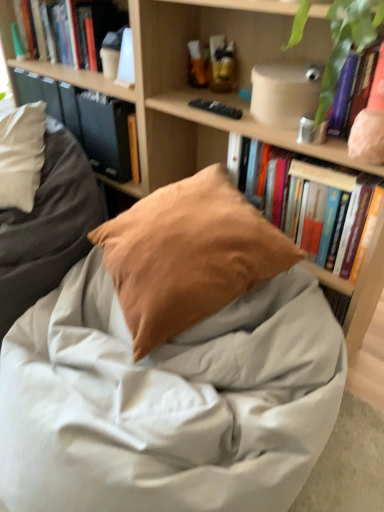
Image resolution: width=384 pixels, height=512 pixels. Describe the element at coordinates (80, 30) in the screenshot. I see `hardcover book at upper left, placed as the first book when sorted from back to front` at that location.

Measure the distance between hardcover book at upper left, placed as the 1th book when sorted from left to right, and camera.

hardcover book at upper left, placed as the 1th book when sorted from left to right, and camera are 1.42 meters apart from each other.

Identify the location of green leafy plant at upper right. (347, 42).

Identify the location of hardcover book at upper left. pos(106,133).

Locate an element on the screen. This screenshot has height=512, width=384. hardcover book at upper right, placed as the second book when sorted from back to front is located at coordinates (323, 176).

What do you see at coordinates (323, 176) in the screenshot? The image size is (384, 512). I see `hardcover book at upper right, which is the first book from bottom to top` at bounding box center [323, 176].

Where is `hardcover book at upper left, the second book when ordered from bottom to top`? hardcover book at upper left, the second book when ordered from bottom to top is located at coordinates (80, 30).

Is hardcover book at upper right, marked as the first book in a right-to-left arrangement, aimed at green leafy plant at upper right?

No.

From the image's perspective, would you say hardcover book at upper right, the 2th book viewed from the left, is positioned over green leafy plant at upper right?

No, from the image's perspective, hardcover book at upper right, the 2th book viewed from the left, is not on top of green leafy plant at upper right.

Between hardcover book at upper right, the 2th book viewed from the left, and green leafy plant at upper right, which one has less height?

green leafy plant at upper right.

Based on the photo, in terms of height, does wooden bookshelf at center look taller or shorter compared to light gray cotton blanket at center?

Clearly, wooden bookshelf at center is taller compared to light gray cotton blanket at center.

Would you say wooden bookshelf at center is to the left or to the right of light gray cotton blanket at center in the picture?

From the image, it's evident that wooden bookshelf at center is to the right of light gray cotton blanket at center.

Is point (142, 127) closer or farther from the camera than point (152, 398)?

Clearly, point (142, 127) is more distant from the camera than point (152, 398).

Does wooden bookshelf at center have a lesser width compared to light gray cotton blanket at center?

No.

Which is behind, light gray cotton blanket at center or suede-like tan pillow at center?

suede-like tan pillow at center is behind.

Is point (200, 349) closer to camera compared to point (135, 205)?

Yes.

Would you say light gray cotton blanket at center is to the left or to the right of suede-like tan pillow at center in the picture?

light gray cotton blanket at center is positioned on suede-like tan pillow at center's left side.

Would you say suede-like tan pillow at center is part of light gray cotton blanket at center's contents?

Yes, light gray cotton blanket at center contains suede-like tan pillow at center.

Does point (265, 19) lie in front of point (143, 406)?

No, (265, 19) is behind (143, 406).

Does matte beige container at upper right turn towards light gray cotton blanket at center?

No, matte beige container at upper right is not turned towards light gray cotton blanket at center.

Considering the relative positions of matte beige container at upper right and light gray cotton blanket at center in the image provided, is matte beige container at upper right to the left of light gray cotton blanket at center from the viewer's perspective?

Incorrect, matte beige container at upper right is not on the left side of light gray cotton blanket at center.

In the scene shown: Is matte beige container at upper right far from light gray cotton blanket at center?

They are positioned close to each other.

Is hardcover book at upper right, placed as the second book when sorted from back to front, positioned beyond the bounds of matte beige container at upper right?

Yes, hardcover book at upper right, placed as the second book when sorted from back to front, is located beyond the bounds of matte beige container at upper right.

Could you tell me if hardcover book at upper right, placed as the second book when sorted from back to front, is turned towards matte beige container at upper right?

No, hardcover book at upper right, placed as the second book when sorted from back to front, is not turned towards matte beige container at upper right.

Which is less distant, (286,222) or (168,131)?

Positioned in front is point (286,222).

Which object is further away from the camera, hardcover book at upper left or hardcover book at upper right, the 2th book viewed from the left?

hardcover book at upper left is behind.

Between hardcover book at upper left and hardcover book at upper right, the 2th book viewed from the left, which one appears on the left side from the viewer's perspective?

hardcover book at upper left.

How many degrees apart are the facing directions of hardcover book at upper left and hardcover book at upper right, placed as the second book when sorted from back to front?

They differ by 2.4 degrees in their facing directions.

Does hardcover book at upper left turn towards hardcover book at upper right, which is the first book from bottom to top?

No.

Where is `bean bag chair that appears in front of the hardcover book at upper left`? The image size is (384, 512). bean bag chair that appears in front of the hardcover book at upper left is located at coordinates (48, 226).

From the image's perspective, is matte brown pillow at center under hardcover book at upper left?

Yes, from the image's perspective, matte brown pillow at center is beneath hardcover book at upper left.

Can we say matte brown pillow at center lies outside hardcover book at upper left?

Yes.

From a real-world perspective, which object stands above the other?

hardcover book at upper left.

This screenshot has height=512, width=384. Find the location of `plant above the hardcover book at upper right, the 2th book viewed from the left (from a real-world perspective)`. plant above the hardcover book at upper right, the 2th book viewed from the left (from a real-world perspective) is located at coordinates (347, 42).

Where is `bookcase on the right of light gray cotton blanket at center`? bookcase on the right of light gray cotton blanket at center is located at coordinates 197,89.

Estimate the real-world distances between objects in this image. Which object is closer to wooden bookshelf at center, hardcover book at upper right, placed as the second book when sorted from back to front, or suede-like tan pillow at center?

The object closer to wooden bookshelf at center is hardcover book at upper right, placed as the second book when sorted from back to front.

Considering their positions, is light gray cotton blanket at center positioned closer to matte beige container at upper right than hardcover book at upper right, positioned as the second book in top-to-bottom order?

The object closer to matte beige container at upper right is hardcover book at upper right, positioned as the second book in top-to-bottom order.

Which object lies further to the anchor point light gray cotton blanket at center, hardcover book at upper right, placed as the 1th book when sorted from front to back, or wooden bookshelf at center?

Based on the image, hardcover book at upper right, placed as the 1th book when sorted from front to back, appears to be further to light gray cotton blanket at center.

Which object lies nearer to the anchor point hardcover book at upper left, matte brown pillow at center or hardcover book at upper left, acting as the 2th book starting from the right?

Among the two, hardcover book at upper left, acting as the 2th book starting from the right, is located nearer to hardcover book at upper left.

Which object lies further to the anchor point hardcover book at upper left, hardcover book at upper left, placed as the 1th book when sorted from left to right, or green leafy plant at upper right?

Based on the image, green leafy plant at upper right appears to be further to hardcover book at upper left.

Looking at this image, considering their positions, is green leafy plant at upper right positioned further to hardcover book at upper left than light gray cotton blanket at center?

The object further to hardcover book at upper left is green leafy plant at upper right.

Consider the image. Estimate the real-world distances between objects in this image. Which object is further from hardcover book at upper left, hardcover book at upper right, which is the first book from bottom to top, or matte beige container at upper right?

Based on the image, hardcover book at upper right, which is the first book from bottom to top, appears to be further to hardcover book at upper left.

Estimate the real-world distances between objects in this image. Which object is closer to matte brown pillow at center, wooden bookshelf at center or matte beige container at upper right?

Based on the image, wooden bookshelf at center appears to be nearer to matte brown pillow at center.

Find the location of `plant between matte beige container at upper right and hardcover book at upper left in the front-back direction`. plant between matte beige container at upper right and hardcover book at upper left in the front-back direction is located at coordinates (347, 42).

This screenshot has width=384, height=512. In order to click on plant between hardcover book at upper left, acting as the 2th book starting from the right, and suede-like tan pillow at center in the up-down direction in this screenshot , I will do `click(347, 42)`.

Identify the location of bookcase located between hardcover book at upper left and hardcover book at upper right, placed as the 1th book when sorted from front to back, in the left-right direction. This screenshot has width=384, height=512. (197, 89).

Image resolution: width=384 pixels, height=512 pixels. I want to click on pillow between green leafy plant at upper right and light gray cotton blanket at center vertically, so click(188, 255).